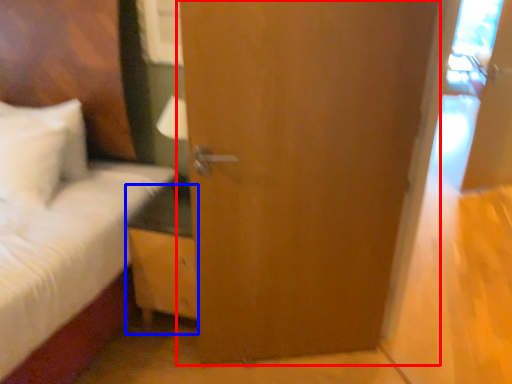
Question: Which object is closer to the camera taking this photo, door (highlighted by a red box) or nightstand (highlighted by a blue box)?

Choices:
 (A) door
 (B) nightstand

Answer: (A)